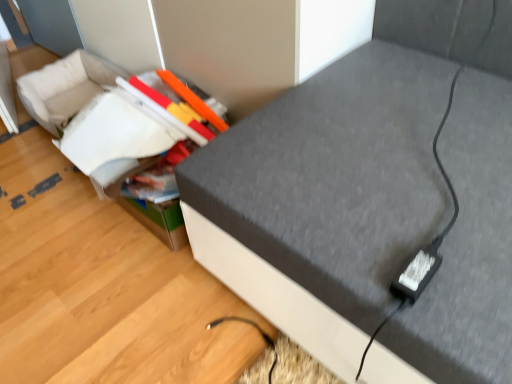
Question: Is textured gray sofa at center positioned in front of black plastic plug at lower right?

Choices:
 (A) yes
 (B) no

Answer: (A)

Question: Is textured gray sofa at center beside black plastic plug at lower right?

Choices:
 (A) yes
 (B) no

Answer: (B)

Question: Is textured gray sofa at center positioned far away from black plastic plug at lower right?

Choices:
 (A) yes
 (B) no

Answer: (B)

Question: Is black plastic plug at lower right a part of textured gray sofa at center?

Choices:
 (A) yes
 (B) no

Answer: (A)

Question: Considering the relative positions of textured gray sofa at center and black plastic plug at lower right in the image provided, is textured gray sofa at center behind black plastic plug at lower right?

Choices:
 (A) yes
 (B) no

Answer: (B)

Question: From the image's perspective, would you say textured gray sofa at center is shown under black plastic plug at lower right?

Choices:
 (A) yes
 (B) no

Answer: (B)

Question: From the image's perspective, does matte plastic storage box at center appear higher than black plastic plug at lower right?

Choices:
 (A) no
 (B) yes

Answer: (B)

Question: Can you confirm if matte plastic storage box at center is taller than black plastic plug at lower right?

Choices:
 (A) no
 (B) yes

Answer: (B)

Question: From a real-world perspective, is matte plastic storage box at center positioned over black plastic plug at lower right based on gravity?

Choices:
 (A) yes
 (B) no

Answer: (B)

Question: From the image's perspective, would you say matte plastic storage box at center is shown under black plastic plug at lower right?

Choices:
 (A) yes
 (B) no

Answer: (B)

Question: Considering the relative positions of matte plastic storage box at center and black plastic plug at lower right in the image provided, is matte plastic storage box at center to the left of black plastic plug at lower right from the viewer's perspective?

Choices:
 (A) no
 (B) yes

Answer: (B)

Question: Is matte plastic storage box at center in contact with black plastic plug at lower right?

Choices:
 (A) no
 (B) yes

Answer: (A)

Question: Considering the relative positions of matte plastic storage box at center and textured gray sofa at center in the image provided, is matte plastic storage box at center to the right of textured gray sofa at center from the viewer's perspective?

Choices:
 (A) yes
 (B) no

Answer: (B)